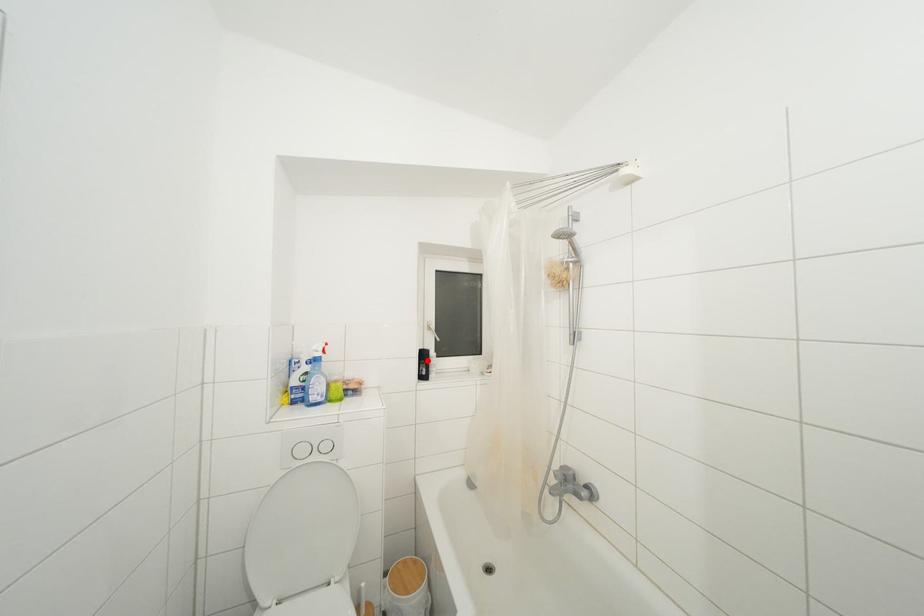
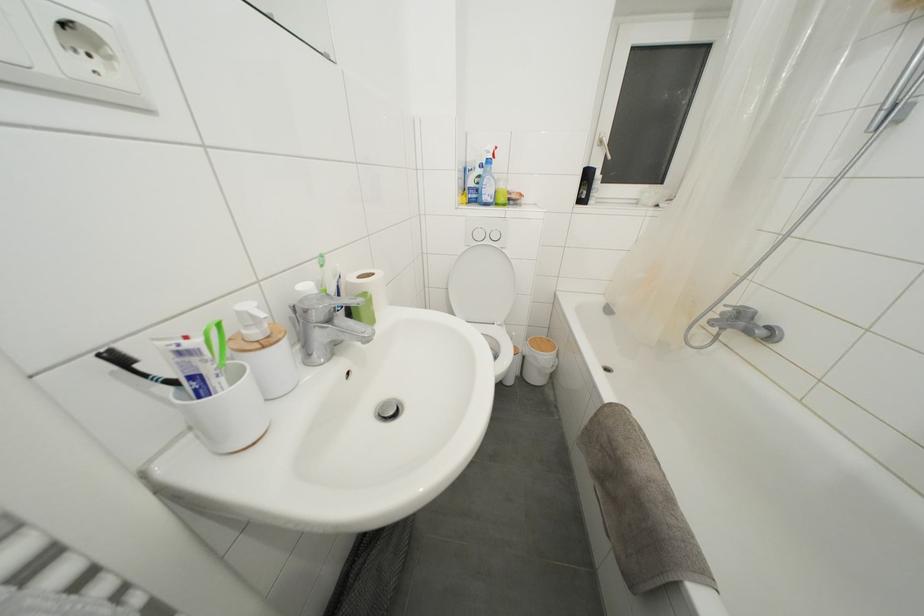
Question: A red point is marked in image1. In image2, is the corresponding 3D point closer to the camera or farther? Reply with the corresponding letter.

Choices:
 (A) The corresponding 3D point is closer.
 (B) The corresponding 3D point is farther.

Answer: (A)